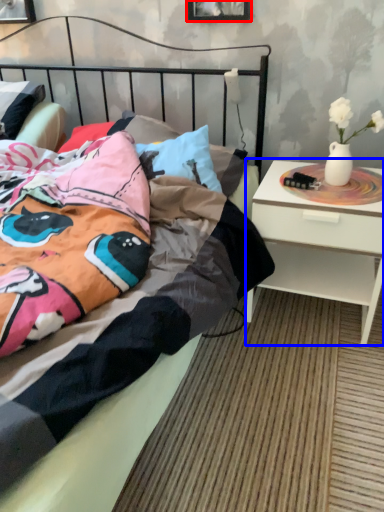
Question: Which of the following is the farthest to the observer, picture frame (highlighted by a red box) or nightstand (highlighted by a blue box)?

Choices:
 (A) picture frame
 (B) nightstand

Answer: (A)